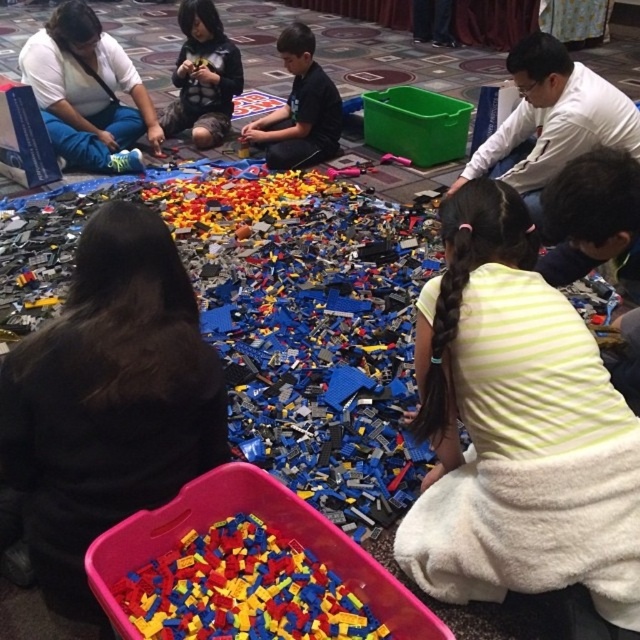
Between white matte shirt at upper right and matte black shirt at upper center, which one has less height?

white matte shirt at upper right

Does white matte shirt at upper right lie in front of matte black shirt at upper center?

Yes, white matte shirt at upper right is closer to the viewer.

Which is in front, point (584, 125) or point (196, 45)?

Point (584, 125) is more forward.

You are a GUI agent. You are given a task and a screenshot of the screen. Output one action in this format:
    pyautogui.click(x=<x>, y=<y>)
    Task: Click on the white matte shirt at upper right
    
    Given the screenshot: What is the action you would take?
    pyautogui.click(x=552, y=118)

Does brick-like plastic toys at lower center appear over smooth black shirt at center?

No.

Is brick-like plastic toys at lower center to the right of smooth black shirt at center from the viewer's perspective?

Correct, you'll find brick-like plastic toys at lower center to the right of smooth black shirt at center.

Locate an element on the screen. The height and width of the screenshot is (640, 640). brick-like plastic toys at lower center is located at coordinates (243, 589).

What do you see at coordinates (300, 108) in the screenshot? I see `smooth black shirt at center` at bounding box center [300, 108].

Does smooth black shirt at center have a lesser height compared to matte black shirt at upper center?

Correct, smooth black shirt at center is not as tall as matte black shirt at upper center.

In order to click on smooth black shirt at center in this screenshot , I will do pyautogui.click(x=300, y=108).

In order to click on smooth black shirt at center in this screenshot , I will do `click(300, 108)`.